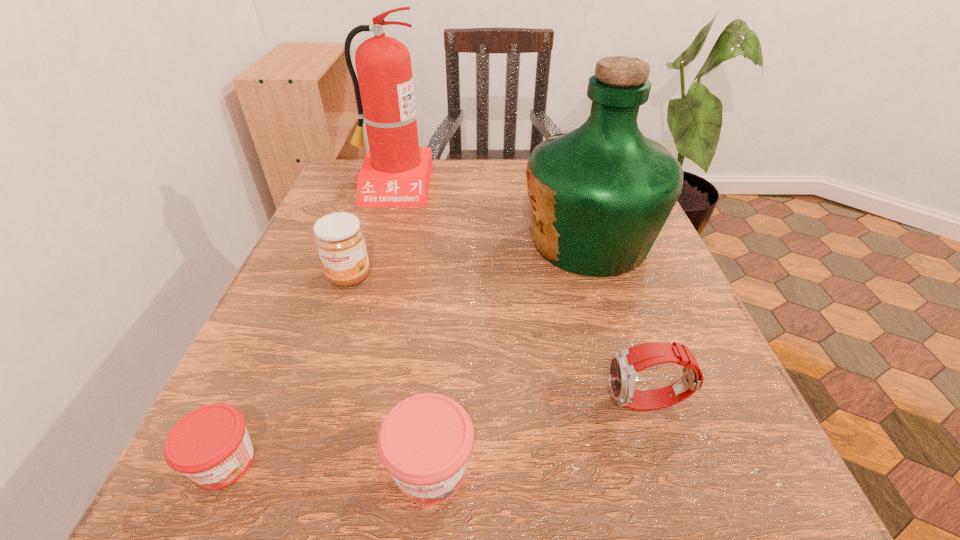
You are a GUI agent. You are given a task and a screenshot of the screen. Output one action in this format:
    pyautogui.click(x=<x>, y=<y>)
    Task: Click on the fire extinguisher
    Image resolution: width=960 pixels, height=540 pixels.
    Given the screenshot: What is the action you would take?
    pyautogui.click(x=396, y=172)

Image resolution: width=960 pixels, height=540 pixels. Find the location of `liquor`. liquor is located at coordinates (599, 195).

I want to click on the tallest jam, so click(340, 242).

Locate an element on the screen. watch is located at coordinates (625, 364).

Identify the location of the fifth tallest object. This screenshot has width=960, height=540. (424, 442).

Locate an element on the screen. the rightmost jam is located at coordinates (424, 442).

At what (x,y) coordinates should I click in order to perform the action: click on the shortest object. Please return your answer as a coordinate pair (x, y). This screenshot has height=540, width=960. Looking at the image, I should click on (211, 446).

Identify the location of free spot located on the front-facing side of the fire extinguisher. (360, 296).

Find the location of a particular element. free space located 0.230m on the label side of the liquor is located at coordinates (407, 241).

This screenshot has width=960, height=540. What are the coordinates of `vacant space located 0.170m on the label side of the liquor` in the screenshot? It's located at tap(437, 241).